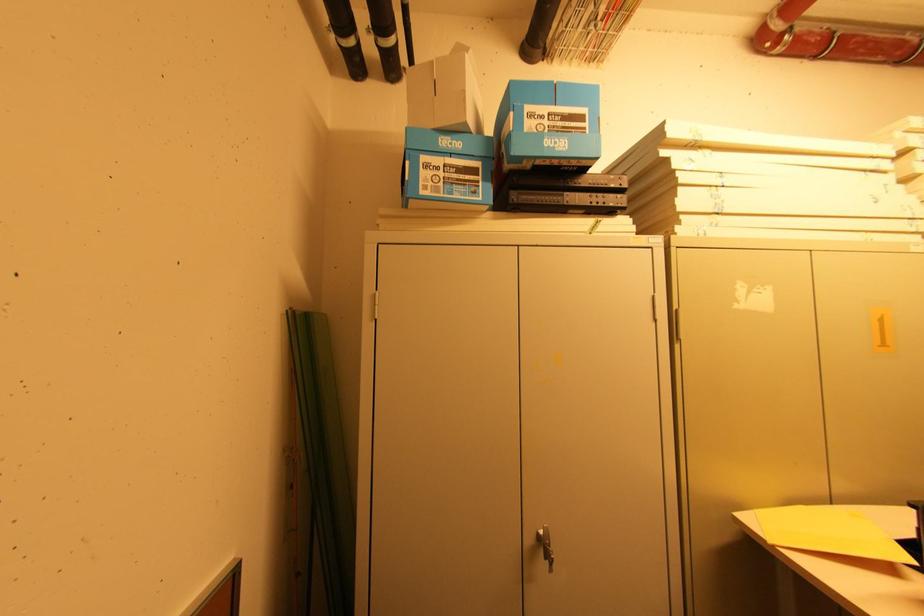
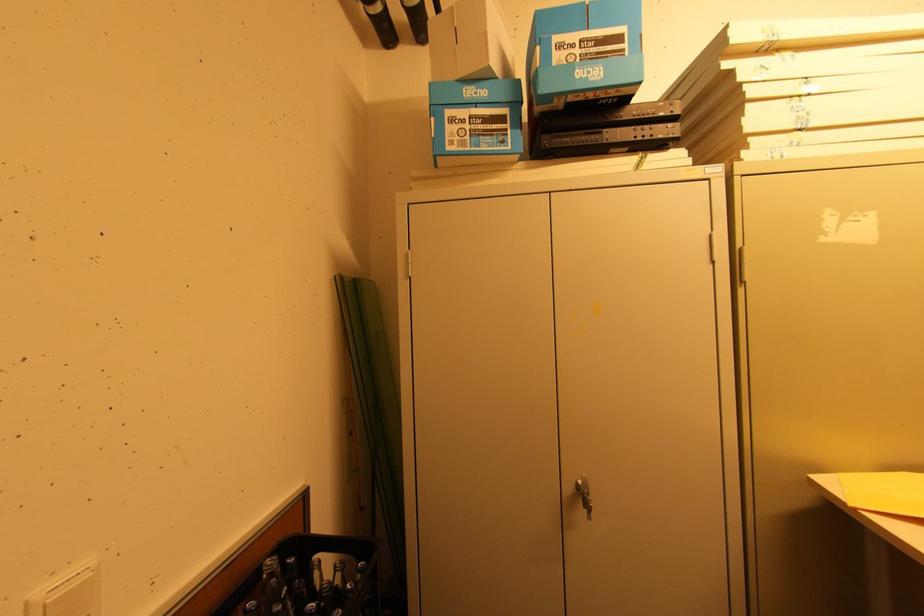
Locate, in the second image, the point that corresponds to pixel 553 570 in the first image.

(592, 519)